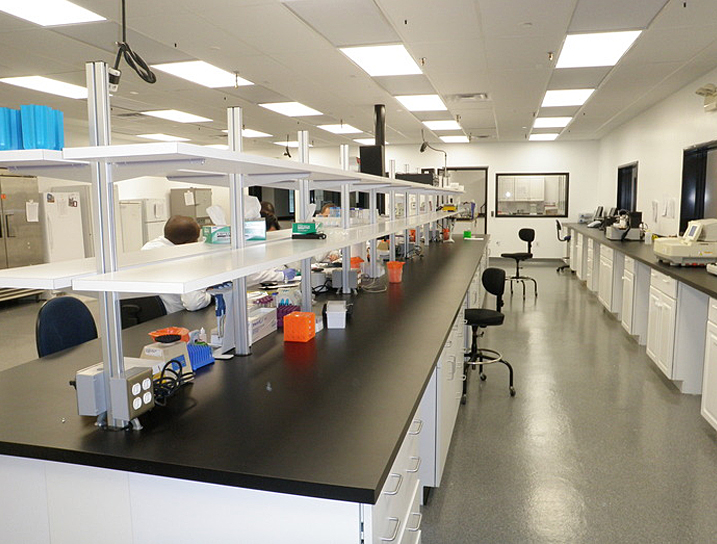
The height and width of the screenshot is (544, 717). In order to click on doorway in this screenshot , I will do `click(474, 182)`.